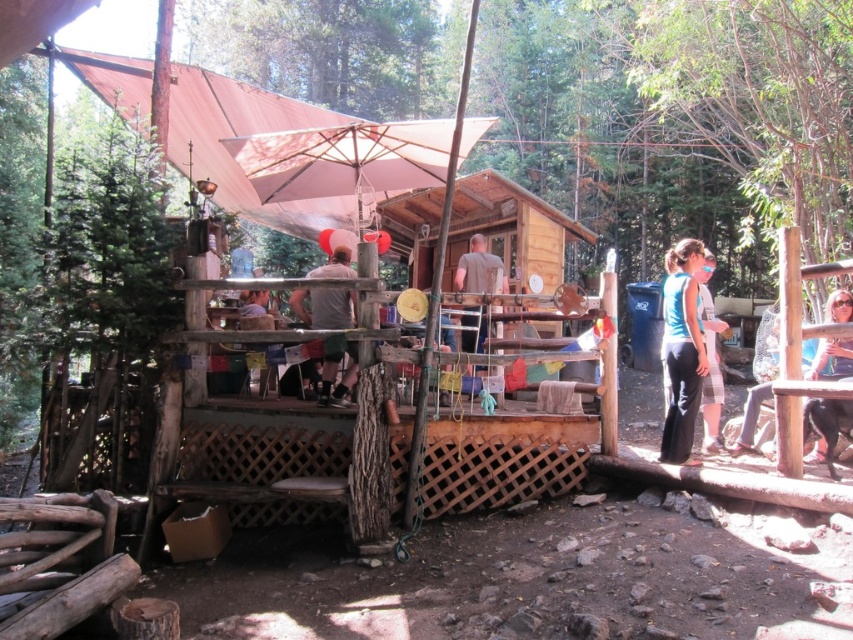
Which of these two, blue fabric pants at lower right or blue fabric shirt at center, stands shorter?

blue fabric shirt at center

Is blue fabric pants at lower right bigger than blue fabric shirt at center?

Incorrect, blue fabric pants at lower right is not larger than blue fabric shirt at center.

Who is more forward, (670, 346) or (706, 259)?

Positioned in front is point (670, 346).

Locate an element on the screen. blue fabric pants at lower right is located at coordinates (682, 349).

Who is shorter, blue fabric pants at lower right or gray fabric shirt at center?

gray fabric shirt at center

Does point (683, 312) lie in front of point (473, 257)?

Yes.

Does point (682, 385) come farther from viewer compared to point (462, 259)?

That is False.

At what (x,y) coordinates should I click in order to perform the action: click on blue fabric pants at lower right. Please return your answer as a coordinate pair (x, y). Looking at the image, I should click on (682, 349).

Is point (706, 376) more distant than point (827, 304)?

Yes, point (706, 376) is farther from viewer.

Where is `blue fabric shirt at center`? The width and height of the screenshot is (853, 640). blue fabric shirt at center is located at coordinates (711, 360).

Between point (708, 349) and point (828, 317), which one is positioned behind?

The point (708, 349) is more distant.

Image resolution: width=853 pixels, height=640 pixels. I want to click on blue fabric shirt at center, so click(711, 360).